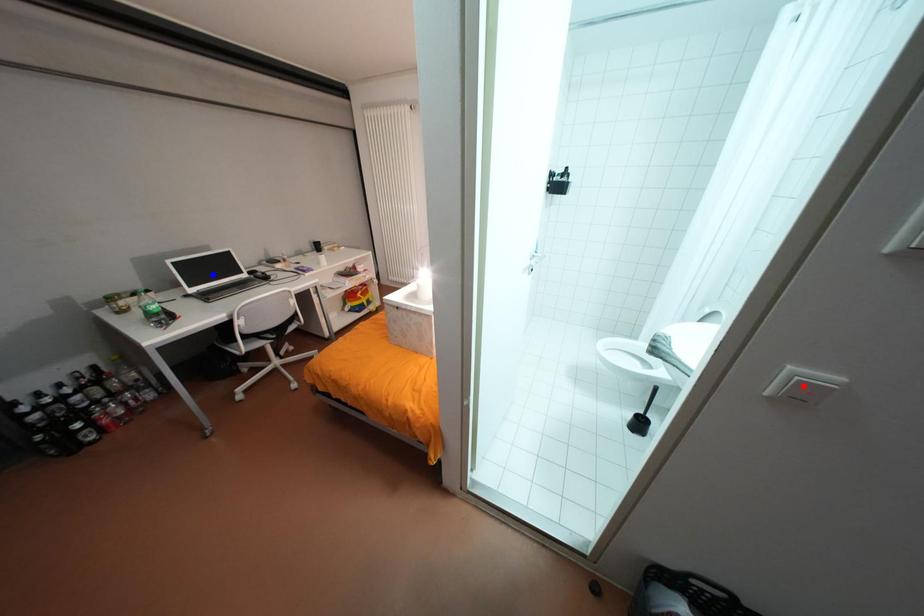
Question: In the image, two points are highlighted. Which point is nearer to the camera? Reply with the corresponding letter.

Choices:
 (A) blue point
 (B) red point

Answer: (B)